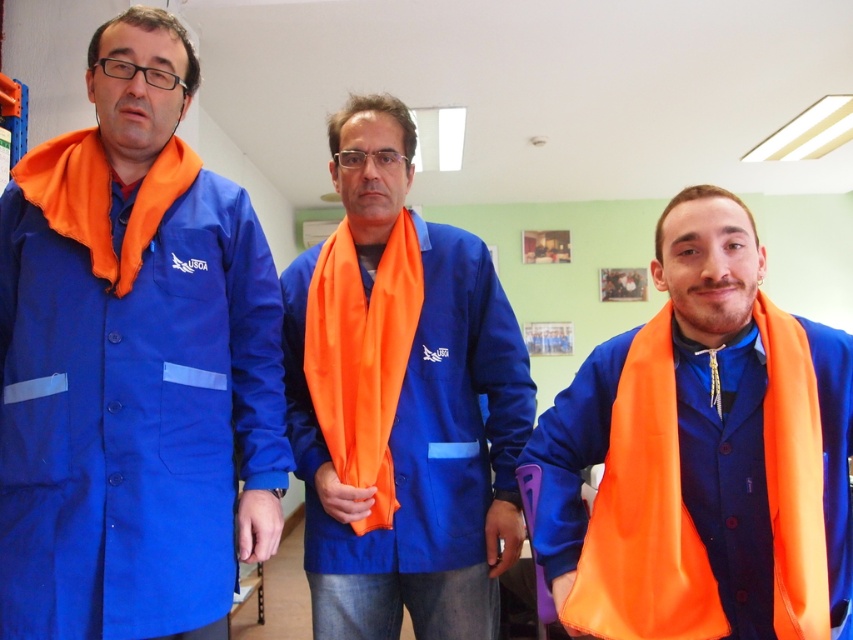
You are a photographer standing at the front of the room. You want to take a photo of the orange fabric scarf at right so that it fills the frame. The camera you are using has a minimum focusing distance of 4 feet. Will you be able to take the photo without moving closer?

The orange fabric scarf at right is 3.91 feet away from the camera, which is within the minimum focusing distance of 4 feet. Therefore, you can take the photo without moving closer.

You are standing in the workshop and need to hand out two identical safety manuals to the person wearing the matte blue coat at left and the matte blue jacket at center. Since you can only reach up to shoulder height, will you be able to place both manuals on their respective garments without needing a step stool?

The matte blue coat at left is closer to the viewer than the matte blue jacket at center, so you can reach the matte blue coat at left easily. However, the matte blue jacket at center is further away, so you might need a step stool to reach it.

You are standing in the workshop and need to reach the point marked as point (784, 362). There is an obstacle at point (354, 381). Can you walk directly to your destination without going around the obstacle?

Point (784, 362) is in front of point (354, 381), so you can walk directly to point (784, 362) without needing to go around the obstacle at point (354, 381).